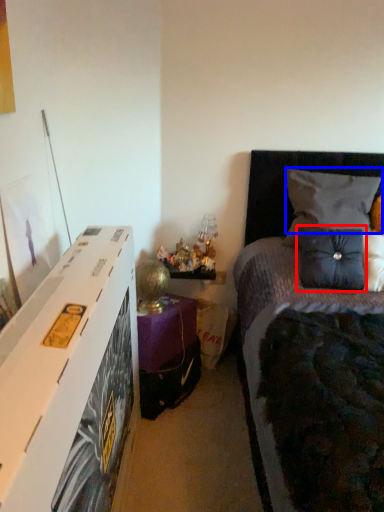
Question: Which of the following is the closest to the observer, pillow (highlighted by a red box) or pillow (highlighted by a blue box)?

Choices:
 (A) pillow
 (B) pillow

Answer: (A)